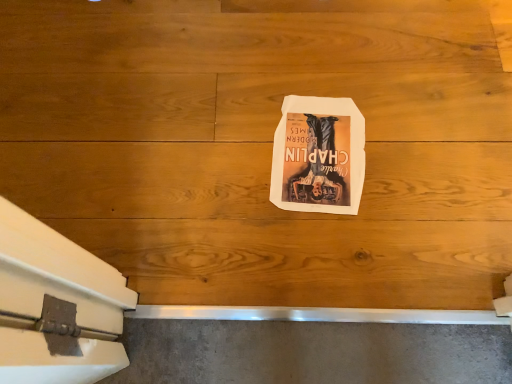
The height and width of the screenshot is (384, 512). In order to click on free space in front of white paper at center in this screenshot , I will do (320, 240).